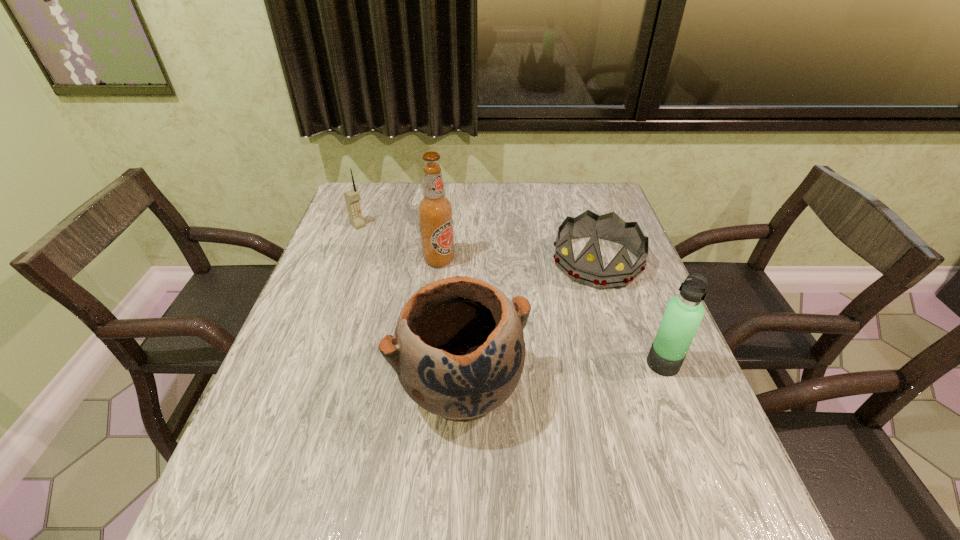
In order to click on vacant space that's between the pottery and the thermos bottle in this screenshot , I will do `click(562, 375)`.

Where is `blank region between the pottery and the tiara`? The width and height of the screenshot is (960, 540). blank region between the pottery and the tiara is located at coordinates (529, 324).

Image resolution: width=960 pixels, height=540 pixels. I want to click on vacant space that's between the tiara and the thermos bottle, so (x=630, y=313).

The image size is (960, 540). I want to click on empty space between the pottery and the tiara, so pos(529,324).

Identify the location of vacant point located between the tiara and the farthest object. This screenshot has width=960, height=540. (478, 243).

You are a GUI agent. You are given a task and a screenshot of the screen. Output one action in this format:
    pyautogui.click(x=<x>, y=<y>)
    Task: Click on the vacant point located between the tiara and the cellular telephone
    
    Given the screenshot: What is the action you would take?
    pyautogui.click(x=478, y=243)

Find the location of a particular element. This screenshot has height=540, width=960. the second closest object to the beer bottle is located at coordinates (458, 350).

Locate which object ranks in proximity to the tiara. Please provide its 2D coordinates. Your answer should be formatted as a tuple, i.e. [(x, y)], where the tuple contains the x and y coordinates of a point satisfying the conditions above.

[(458, 350)]

This screenshot has width=960, height=540. I want to click on blank space that satisfies the following two spatial constraints: 1. on the back side of the pottery; 2. on the left side of the tiara, so click(466, 261).

Find the location of a particular element. free location that satisfies the following two spatial constraints: 1. on the front side of the farthest object; 2. on the left side of the pottery is located at coordinates (300, 387).